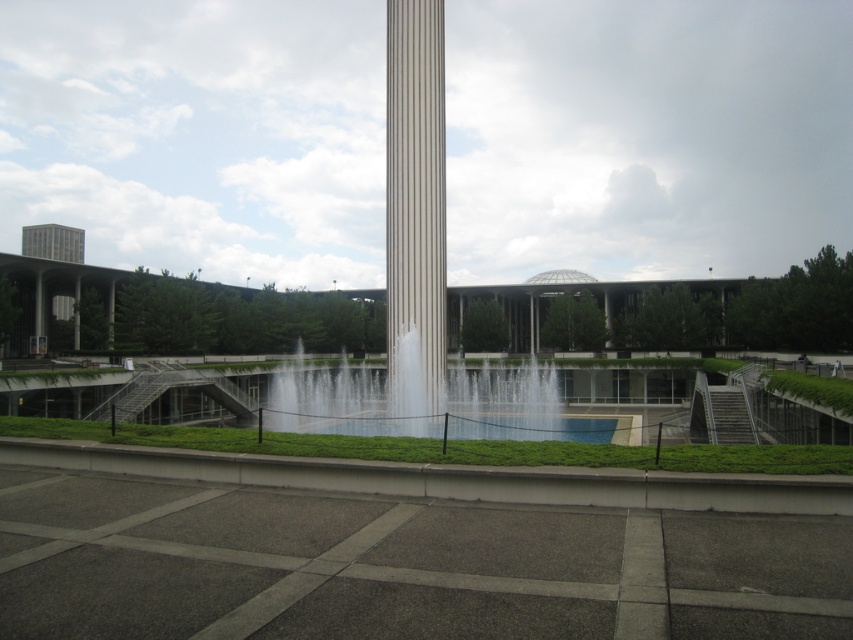
Question: Can you confirm if white glossy column at center is bigger than gray concrete tower at upper left?

Choices:
 (A) no
 (B) yes

Answer: (A)

Question: Which object is positioned farthest from the clear water at center?

Choices:
 (A) gray concrete tower at upper left
 (B) white glossy column at center
 (C) white glossy fountain at center

Answer: (A)

Question: Which point is farther to the camera?

Choices:
 (A) (49, 248)
 (B) (410, 241)
 (C) (399, 112)

Answer: (A)

Question: Which of the following is the farthest from the observer?

Choices:
 (A) white glossy column at center
 (B) clear water at center
 (C) gray concrete tower at upper left
 (D) white glossy fountain at center

Answer: (C)

Question: Does white glossy fountain at center appear on the right side of gray concrete tower at upper left?

Choices:
 (A) yes
 (B) no

Answer: (A)

Question: Does white glossy column at center come in front of gray concrete tower at upper left?

Choices:
 (A) no
 (B) yes

Answer: (B)